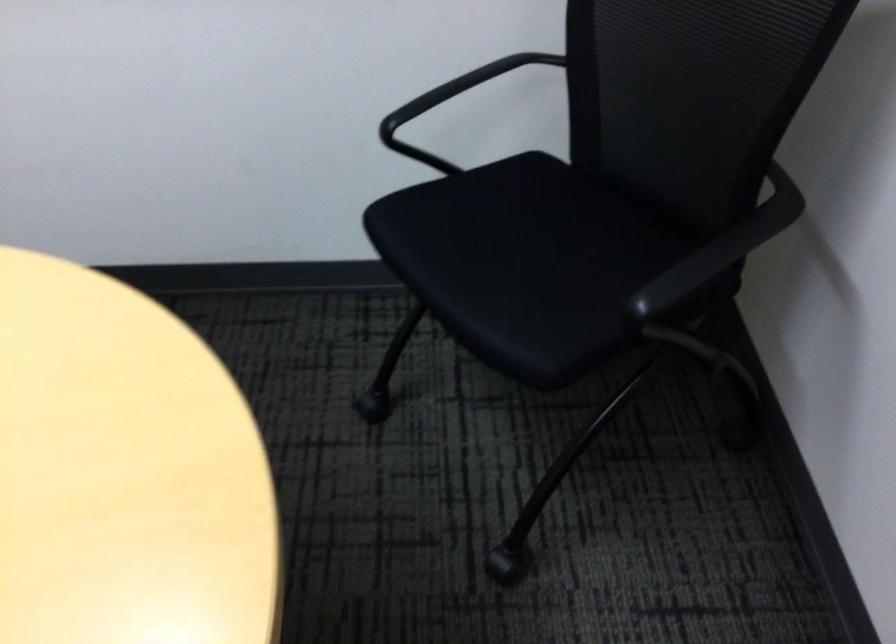
Locate an element on the screen. This screenshot has height=644, width=896. chair sitting surface is located at coordinates (530, 269).